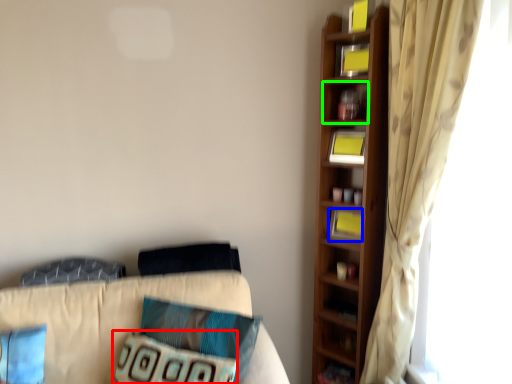
Question: Estimate the real-world distances between objects in this image. Which object is closer to pillow (highlighted by a red box), book (highlighted by a blue box) or cabinet (highlighted by a green box)?

Choices:
 (A) book
 (B) cabinet

Answer: (A)